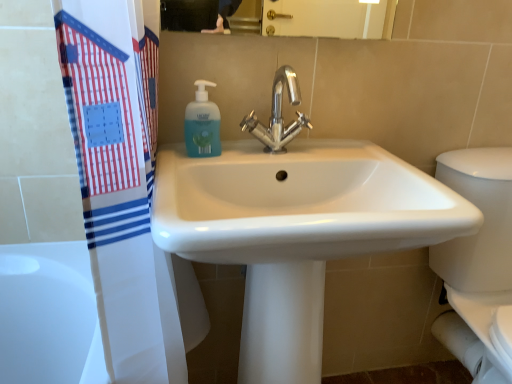
Question: Considering the positions of white glossy porcelain at right and white glossy sink at center in the image, is white glossy porcelain at right bigger or smaller than white glossy sink at center?

Choices:
 (A) small
 (B) big

Answer: (A)

Question: In the image, is white glossy porcelain at right on the left side or the right side of white glossy sink at center?

Choices:
 (A) right
 (B) left

Answer: (A)

Question: Based on their relative distances, which object is farther from the polished chrome faucet at center?

Choices:
 (A) translucent plastic soap dispenser at upper center
 (B) white glossy sink at center
 (C) white glossy porcelain at right

Answer: (C)

Question: Which is farther from the translucent plastic soap dispenser at upper center?

Choices:
 (A) white glossy sink at center
 (B) polished chrome faucet at center
 (C) white glossy porcelain at right

Answer: (C)